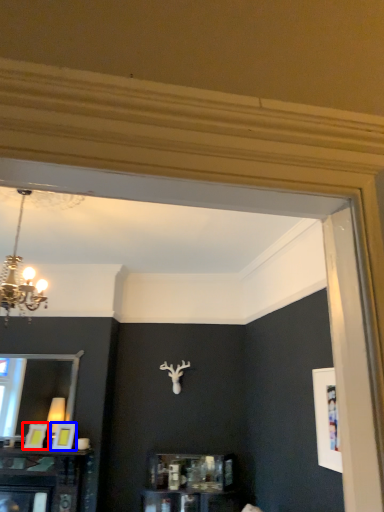
Question: Which object is closer to the camera taking this photo, picture frame (highlighted by a red box) or picture frame (highlighted by a blue box)?

Choices:
 (A) picture frame
 (B) picture frame

Answer: (B)